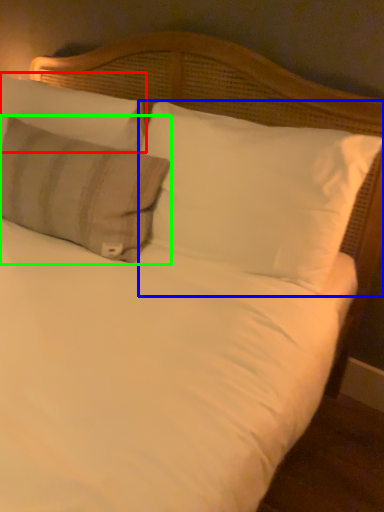
Question: Considering the real-world distances, which object is closest to pillow (highlighted by a red box)? pillow (highlighted by a blue box) or pillow (highlighted by a green box).

Choices:
 (A) pillow
 (B) pillow

Answer: (B)